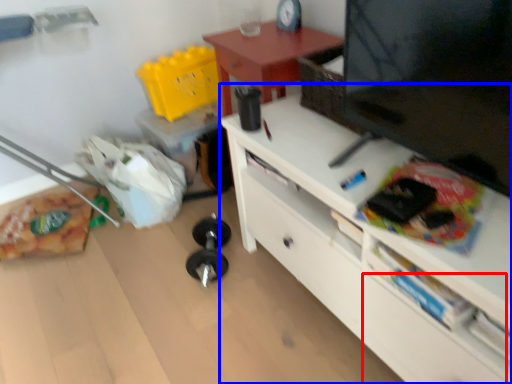
Question: Which object appears closest to the camera in this image, drawer (highlighted by a red box) or desk (highlighted by a blue box)?

Choices:
 (A) drawer
 (B) desk

Answer: (B)